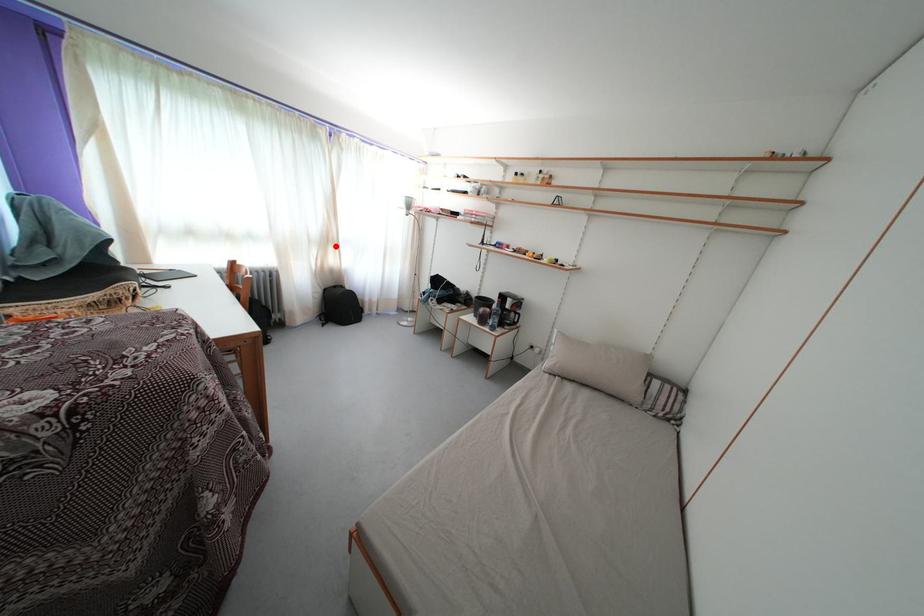
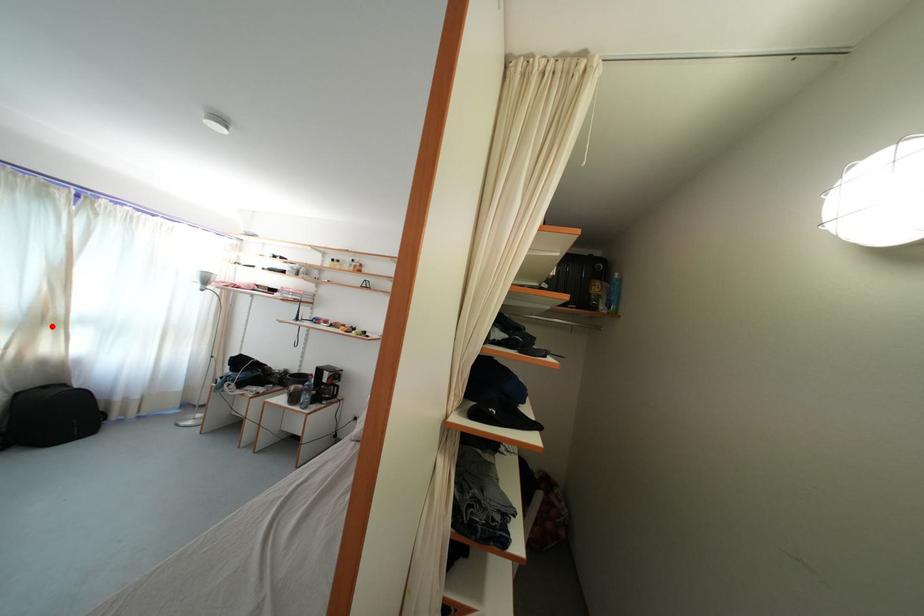
I am providing you with two images of the same scene from different viewpoints. A red point is marked on the first image and another point is marked on the second image. Do the highlighted points in image1 and image2 indicate the same real-world spot?

Yes